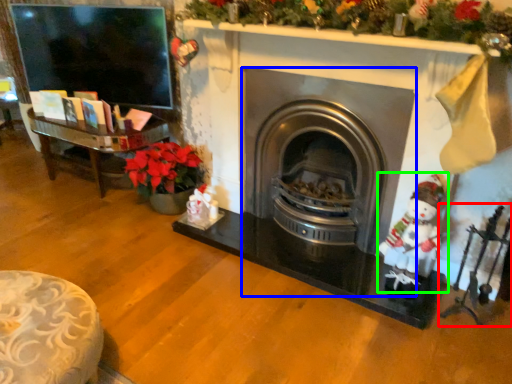
Question: Which object is the farthest from toy (highlighted by a red box)? Choose among these: wood burning stove (highlighted by a blue box) or santa claus (highlighted by a green box).

Choices:
 (A) wood burning stove
 (B) santa claus

Answer: (A)